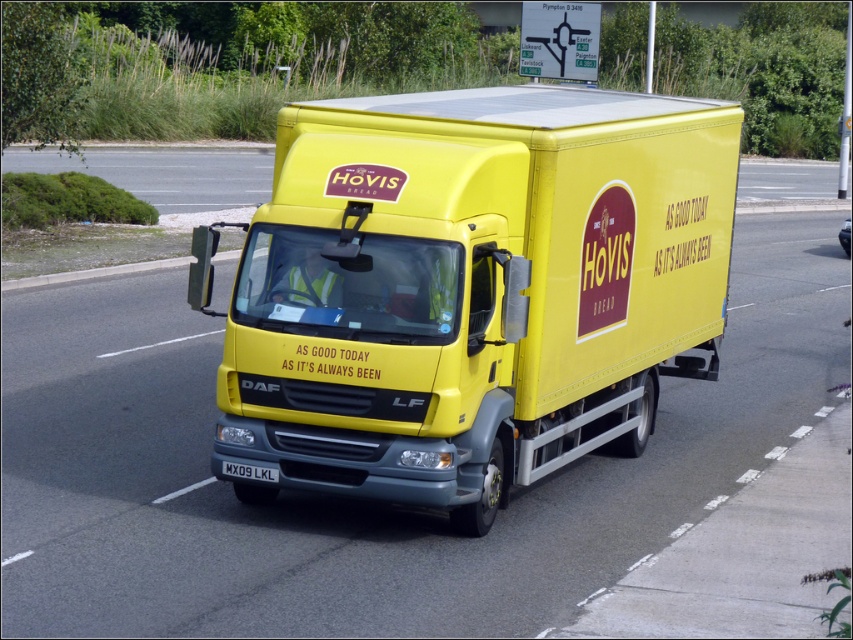
Question: Is yellow matte truck at center smaller than black plastic license plate at center?

Choices:
 (A) yes
 (B) no

Answer: (B)

Question: Does yellow matte truck at center appear on the left side of black plastic license plate at center?

Choices:
 (A) yes
 (B) no

Answer: (B)

Question: Which point is farther to the camera?

Choices:
 (A) (456, 273)
 (B) (228, 461)

Answer: (B)

Question: Is yellow matte truck at center to the left of black plastic license plate at center from the viewer's perspective?

Choices:
 (A) yes
 (B) no

Answer: (B)

Question: Which of the following is the closest to the observer?

Choices:
 (A) (245, 474)
 (B) (287, 394)

Answer: (B)

Question: Among these objects, which one is nearest to the camera?

Choices:
 (A) black plastic license plate at center
 (B) yellow matte truck at center

Answer: (A)